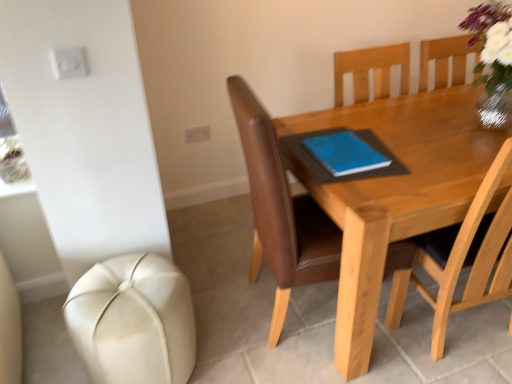
What is the approximate height of blue matte notebook at center?

0.89 inches.

Image resolution: width=512 pixels, height=384 pixels. I want to click on white leather ottoman at lower left, so click(x=133, y=321).

Where is `blue matte notebook at center`? This screenshot has height=384, width=512. blue matte notebook at center is located at coordinates (345, 153).

The image size is (512, 384). I want to click on notebook above the white leather ottoman at lower left (from the image's perspective), so click(345, 153).

Between point (71, 325) and point (324, 139), which one is positioned in front?

The point (71, 325) is more forward.

Are white leather ottoman at lower left and blue matte notebook at center making contact?

white leather ottoman at lower left and blue matte notebook at center are clearly separated.

Can you confirm if white leather ottoman at lower left is positioned to the left of blue matte notebook at center?

Correct, you'll find white leather ottoman at lower left to the left of blue matte notebook at center.

Between blue matte notebook at center and wooden table at center, which one has smaller width?

blue matte notebook at center.

In the scene shown: Which is more to the right, blue matte notebook at center or wooden table at center?

wooden table at center is more to the right.

From a real-world perspective, is blue matte notebook at center positioned under wooden table at center based on gravity?

No, from a real-world perspective, blue matte notebook at center is not beneath wooden table at center.

Which of these two, wooden table at center or white leather ottoman at lower left, is smaller?

white leather ottoman at lower left.

Which is in front, point (353, 243) or point (133, 354)?

The point (353, 243) is closer.

Is white leather ottoman at lower left surrounded by wooden table at center?

Definitely not — white leather ottoman at lower left is not inside wooden table at center.

From the image's perspective, is wooden table at center over white leather ottoman at lower left?

Yes, from the image's perspective, wooden table at center is on top of white leather ottoman at lower left.

Image resolution: width=512 pixels, height=384 pixels. Find the location of `chair to the right of white leather ottoman at lower left`. chair to the right of white leather ottoman at lower left is located at coordinates (281, 210).

Would you say brown leather chair at center is a long distance from white leather ottoman at lower left?

That's not correct — brown leather chair at center is a little close to white leather ottoman at lower left.

Which is behind, brown leather chair at center or white leather ottoman at lower left?

white leather ottoman at lower left.

At what (x,y) coordinates should I click in order to perform the action: click on swivel chair directly beneath the blue matte notebook at center (from a real-world perspective). Please return your answer as a coordinate pair (x, y). This screenshot has height=384, width=512. Looking at the image, I should click on (133, 321).

Could you tell me if blue matte notebook at center is turned towards white leather ottoman at lower left?

No, blue matte notebook at center does not turn towards white leather ottoman at lower left.

Can you confirm if blue matte notebook at center is thinner than white leather ottoman at lower left?

Indeed, blue matte notebook at center has a lesser width compared to white leather ottoman at lower left.

Does blue matte notebook at center turn towards brown leather chair at center?

Yes, blue matte notebook at center is turned towards brown leather chair at center.

Is there a large distance between blue matte notebook at center and brown leather chair at center?

No, blue matte notebook at center is in close proximity to brown leather chair at center.

Does point (332, 142) appear closer or farther from the camera than point (257, 127)?

Clearly, point (332, 142) is more distant from the camera than point (257, 127).

Is blue matte notebook at center outside of brown leather chair at center?

That's incorrect, blue matte notebook at center is not completely outside brown leather chair at center.

How distant is wooden table at center from blue matte notebook at center?

wooden table at center is 10.69 inches from blue matte notebook at center.

Between wooden table at center and blue matte notebook at center, which one has less height?

blue matte notebook at center is shorter.

Does wooden table at center come behind blue matte notebook at center?

No, it is not.

Which point is more distant from viewer, (374, 314) or (348, 138)?

The point (348, 138) is farther from the camera.

Where is `notebook above the white leather ottoman at lower left (from a real-world perspective)`? notebook above the white leather ottoman at lower left (from a real-world perspective) is located at coordinates (345, 153).

You are a GUI agent. You are given a task and a screenshot of the screen. Output one action in this format:
    pyautogui.click(x=<x>, y=<y>)
    Task: Click on the round table on the right of blue matte notebook at center
    
    Given the screenshot: What is the action you would take?
    pyautogui.click(x=395, y=193)

Consider the image. When comparing their distances from blue matte notebook at center, does wooden table at center or white leather ottoman at lower left seem further?

Among the two, white leather ottoman at lower left is located further to blue matte notebook at center.

Which object lies nearer to the anchor point blue matte notebook at center, white leather ottoman at lower left or brown leather chair at center?

Based on the image, brown leather chair at center appears to be nearer to blue matte notebook at center.

Looking at this image, considering their positions, is white leather ottoman at lower left positioned further to blue matte notebook at center than wooden table at center?

white leather ottoman at lower left is further to blue matte notebook at center.

Considering their positions, is brown leather chair at center positioned further to wooden table at center than white leather ottoman at lower left?

white leather ottoman at lower left is positioned further to the anchor wooden table at center.

Estimate the real-world distances between objects in this image. Which object is further from wooden table at center, blue matte notebook at center or brown leather chair at center?

Based on the image, brown leather chair at center appears to be further to wooden table at center.

Based on their spatial positions, is blue matte notebook at center or brown leather chair at center closer to white leather ottoman at lower left?

The object closer to white leather ottoman at lower left is brown leather chair at center.

From the image, which object appears to be farther from white leather ottoman at lower left, wooden table at center or brown leather chair at center?

The object further to white leather ottoman at lower left is wooden table at center.

Which object lies nearer to the anchor point white leather ottoman at lower left, wooden table at center or blue matte notebook at center?

Based on the image, wooden table at center appears to be nearer to white leather ottoman at lower left.

At what (x,y) coordinates should I click in order to perform the action: click on chair located between white leather ottoman at lower left and blue matte notebook at center in the left-right direction. Please return your answer as a coordinate pair (x, y). Looking at the image, I should click on (281, 210).

The image size is (512, 384). What are the coordinates of `chair situated between white leather ottoman at lower left and wooden table at center from left to right` in the screenshot? It's located at (281, 210).

At what (x,y) coordinates should I click in order to perform the action: click on notebook between white leather ottoman at lower left and wooden table at center from left to right. Please return your answer as a coordinate pair (x, y). This screenshot has width=512, height=384. Looking at the image, I should click on (345, 153).

This screenshot has width=512, height=384. I want to click on notebook situated between brown leather chair at center and wooden table at center from left to right, so coord(345,153).